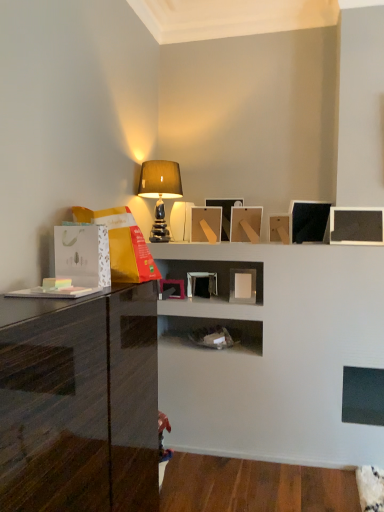
Question: Is matte wood picture frame at center not near glossy black cabinet at left?

Choices:
 (A) yes
 (B) no

Answer: (A)

Question: Can you confirm if matte wood picture frame at center is shorter than glossy black cabinet at left?

Choices:
 (A) yes
 (B) no

Answer: (A)

Question: From the image's perspective, is matte wood picture frame at center on top of glossy black cabinet at left?

Choices:
 (A) no
 (B) yes

Answer: (B)

Question: Can you confirm if matte wood picture frame at center is taller than glossy black cabinet at left?

Choices:
 (A) yes
 (B) no

Answer: (B)

Question: Considering the relative sizes of matte wood picture frame at center and glossy black cabinet at left in the image provided, is matte wood picture frame at center bigger than glossy black cabinet at left?

Choices:
 (A) yes
 (B) no

Answer: (B)

Question: From a real-world perspective, is matte wood picture frame at center beneath glossy black cabinet at left?

Choices:
 (A) no
 (B) yes

Answer: (A)

Question: Is glossy black cabinet at left touching matte beige lampshade at upper center?

Choices:
 (A) no
 (B) yes

Answer: (A)

Question: From a real-world perspective, is glossy black cabinet at left beneath matte beige lampshade at upper center?

Choices:
 (A) yes
 (B) no

Answer: (A)

Question: Does glossy black cabinet at left have a lesser width compared to matte beige lampshade at upper center?

Choices:
 (A) yes
 (B) no

Answer: (B)

Question: Is glossy black cabinet at left located outside matte beige lampshade at upper center?

Choices:
 (A) no
 (B) yes

Answer: (B)

Question: Considering the relative positions of glossy black cabinet at left and matte beige lampshade at upper center in the image provided, is glossy black cabinet at left behind matte beige lampshade at upper center?

Choices:
 (A) yes
 (B) no

Answer: (B)

Question: Is the position of glossy black cabinet at left less distant than that of matte beige lampshade at upper center?

Choices:
 (A) yes
 (B) no

Answer: (A)

Question: Can you confirm if matte beige lampshade at upper center is bigger than matte wood picture frame at center?

Choices:
 (A) no
 (B) yes

Answer: (B)